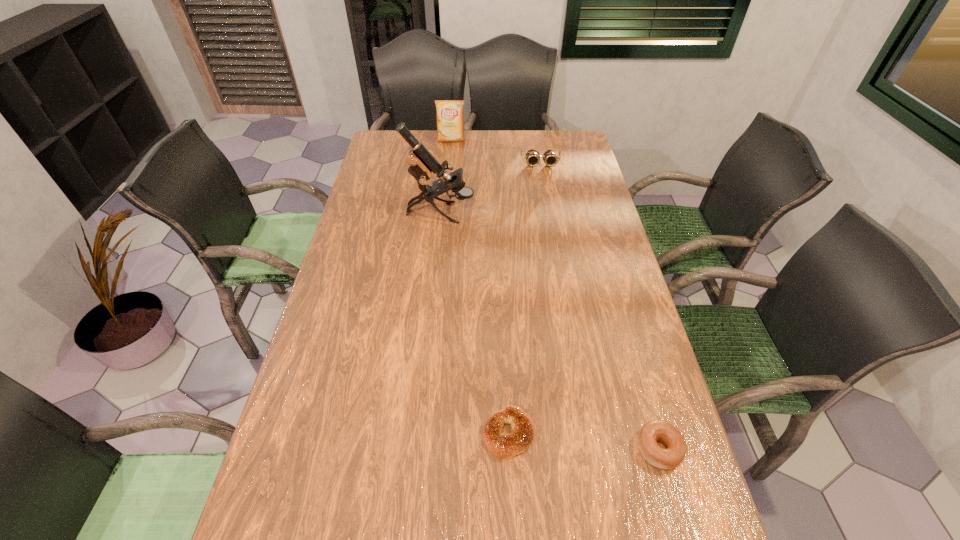
At what (x,y) coordinates should I click in order to perform the action: click on free location that satisfies the following two spatial constraints: 1. on the front-facing side of the farthest object; 2. through the eyepiece of the tallest object. Please return your answer as a coordinate pair (x, y). The height and width of the screenshot is (540, 960). Looking at the image, I should click on (444, 213).

In order to click on vacant area that satisfies the following two spatial constraints: 1. on the front-facing side of the farthest object; 2. on the right side of the third object from left to right in this screenshot , I will do `click(425, 434)`.

At what (x,y) coordinates should I click in order to perform the action: click on vacant space that satisfies the following two spatial constraints: 1. on the front-facing side of the fourth shortest object; 2. through the eyepiece of the tallest object. Please return your answer as a coordinate pair (x, y). Looking at the image, I should click on (444, 213).

In order to click on blank area in the image that satisfies the following two spatial constraints: 1. on the front-facing side of the fourth shortest object; 2. on the right side of the right bagel in this screenshot , I will do `click(423, 449)`.

Image resolution: width=960 pixels, height=540 pixels. Find the location of `vacant space that satisfies the following two spatial constraints: 1. through the eyepiece of the third object from left to right; 2. on the left side of the microscope`. vacant space that satisfies the following two spatial constraints: 1. through the eyepiece of the third object from left to right; 2. on the left side of the microscope is located at coordinates (419, 434).

Where is `free spot that satisfies the following two spatial constraints: 1. on the front-facing side of the farthest object; 2. through the eyepiece of the microscope`? free spot that satisfies the following two spatial constraints: 1. on the front-facing side of the farthest object; 2. through the eyepiece of the microscope is located at coordinates [x=444, y=213].